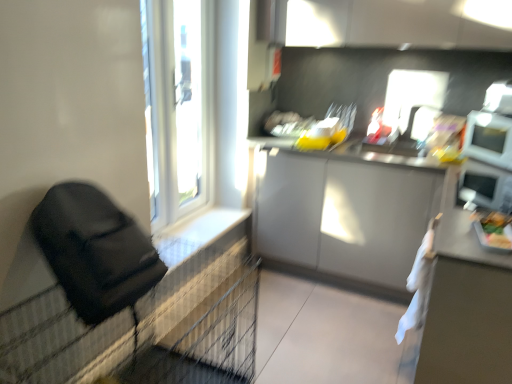
Question: Is green matte tray at right spatially inside white textured tile at lower left, or outside of it?

Choices:
 (A) outside
 (B) inside

Answer: (A)

Question: Considering the relative positions of green matte tray at right and white textured tile at lower left in the image provided, is green matte tray at right to the left or to the right of white textured tile at lower left?

Choices:
 (A) right
 (B) left

Answer: (A)

Question: Considering the real-world distances, which object is closest to the white textured tile at lower left?

Choices:
 (A) black leather bag at left
 (B) green matte tray at right
 (C) white matte table at right
 (D) white plastic window frame at upper left
 (E) white glossy microwave at upper right

Answer: (D)

Question: Estimate the real-world distances between objects in this image. Which object is closer to the white plastic window frame at upper left?

Choices:
 (A) white textured tile at lower left
 (B) green matte tray at right
 (C) white plastic window at upper left
 (D) black leather bag at left
 (E) white matte table at right

Answer: (C)